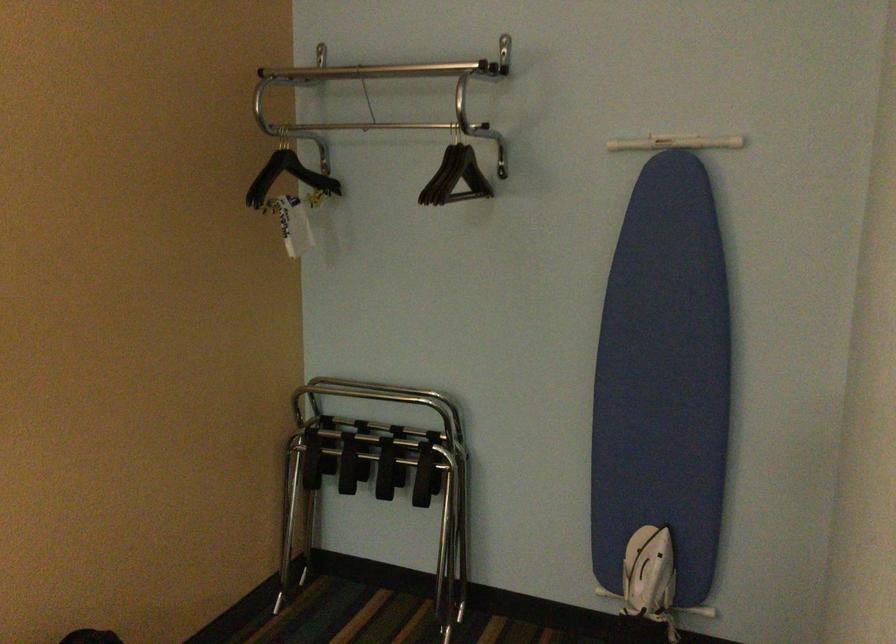
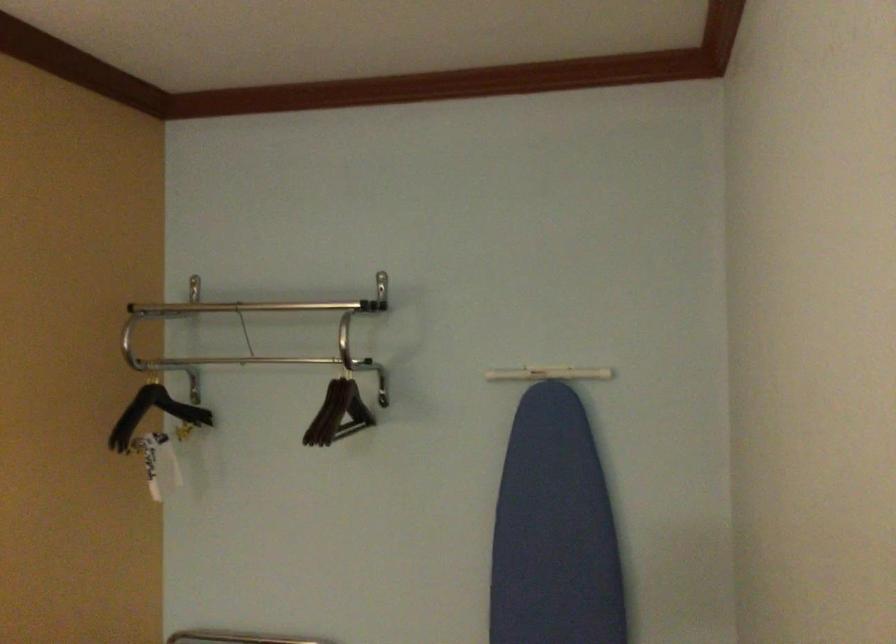
Question: Based on the continuous images, in which direction is the camera rotating? Reply with the corresponding letter.

Choices:
 (A) Left
 (B) Right
 (C) Up
 (D) Down

Answer: (C)